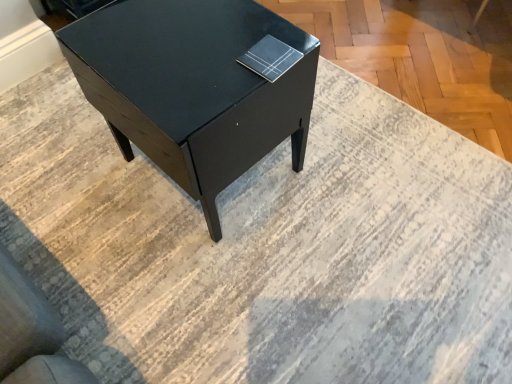
Question: Based on their sizes in the image, would you say matte black table at center is bigger or smaller than matte black book at upper right?

Choices:
 (A) small
 (B) big

Answer: (B)

Question: Is matte black table at center in front of or behind matte black book at upper right in the image?

Choices:
 (A) behind
 (B) front

Answer: (B)

Question: From a real-world perspective, is matte black table at center above or below matte black book at upper right?

Choices:
 (A) above
 (B) below

Answer: (B)

Question: In the image, is matte black book at upper right positioned in front of or behind matte black table at center?

Choices:
 (A) front
 (B) behind

Answer: (B)

Question: Would you say matte black book at upper right is to the left or to the right of matte black table at center in the picture?

Choices:
 (A) right
 (B) left

Answer: (A)

Question: Is matte black book at upper right inside or outside of matte black table at center?

Choices:
 (A) inside
 (B) outside

Answer: (B)

Question: Does point (266, 36) appear closer or farther from the camera than point (99, 74)?

Choices:
 (A) closer
 (B) farther

Answer: (B)